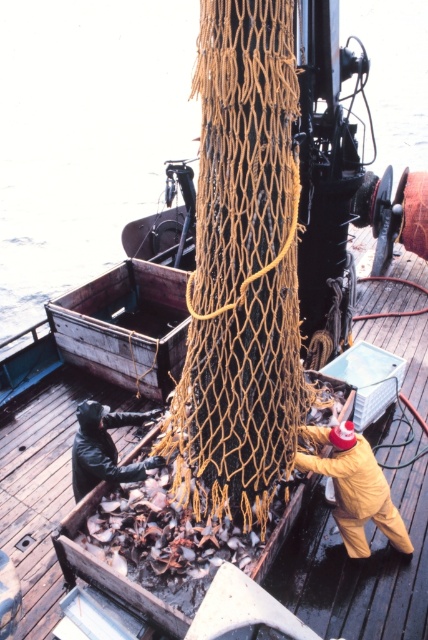
Does yellow matte overall at lower right appear under black rubber gloves at lower left?

Indeed, yellow matte overall at lower right is positioned under black rubber gloves at lower left.

Is point (357, 500) positioned behind point (109, 461)?

No, (357, 500) is closer to viewer.

Locate an element on the screen. Image resolution: width=428 pixels, height=640 pixels. yellow matte overall at lower right is located at coordinates (356, 490).